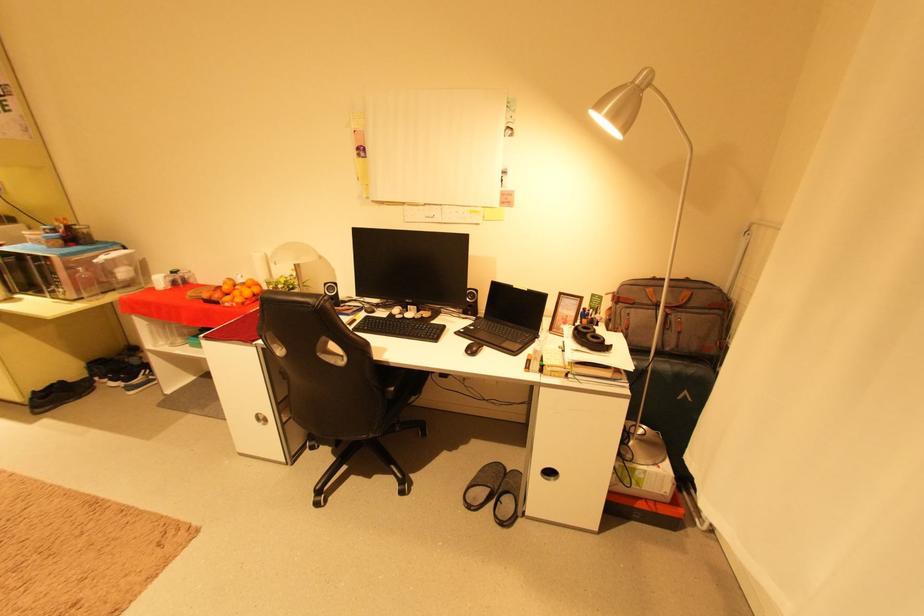
The height and width of the screenshot is (616, 924). Find the location of `black computer mouse`. black computer mouse is located at coordinates (472, 349).